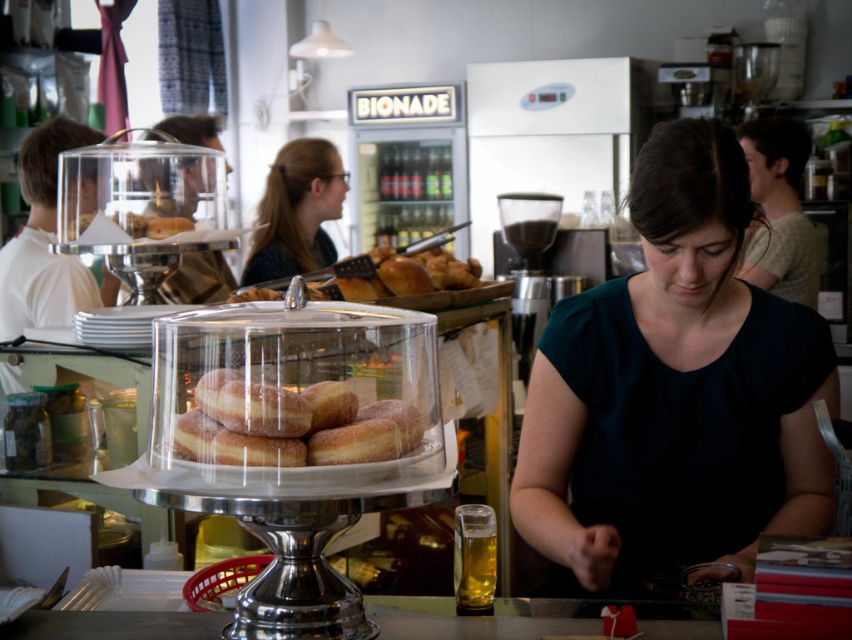
In the scene shown: You are standing in the bakery and want to take a photo of the light beige shirt at upper right. If your camera has a maximum focus range of 10 feet, will you be able to capture it clearly?

The light beige shirt at upper right is 11.66 feet from the camera, which exceeds the maximum focus range of 10 feet. Therefore, the camera cannot capture it clearly.